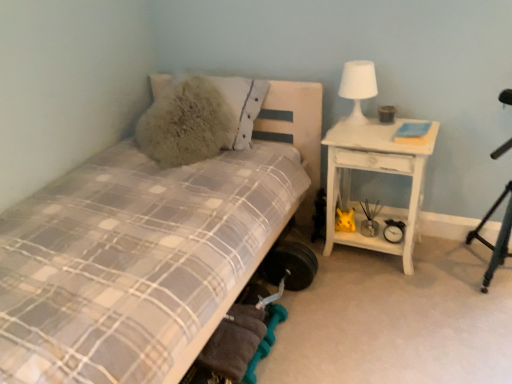
Locate an element on the screen. vacant area to the left of teal metallic tripod at right is located at coordinates (441, 281).